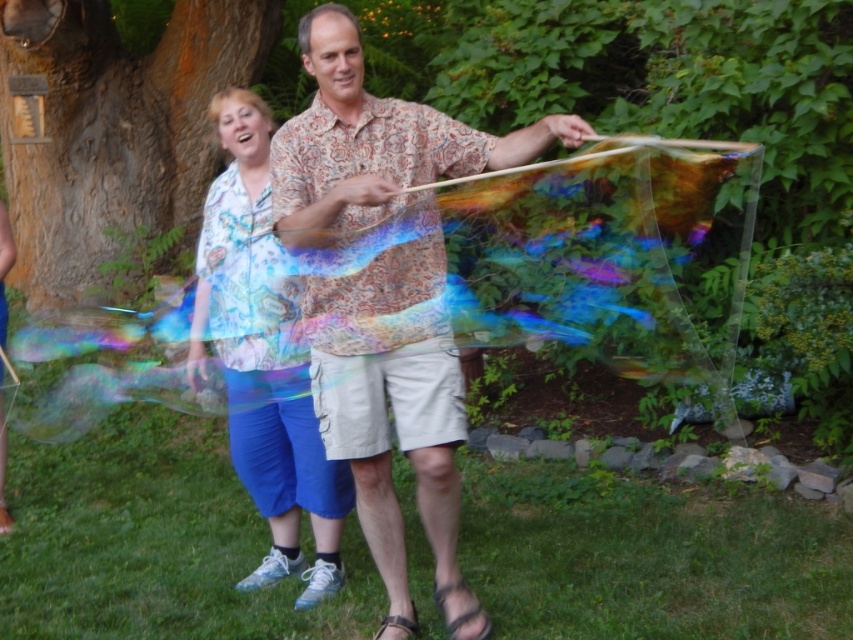
Is patterned fabric shirt at center bigger than matte floral blouse at center?

Indeed, patterned fabric shirt at center has a larger size compared to matte floral blouse at center.

From the picture: Who is more forward, [398,179] or [193,385]?

Point [398,179] is in front.

Find the location of a particular element. This screenshot has height=640, width=853. patterned fabric shirt at center is located at coordinates (386, 296).